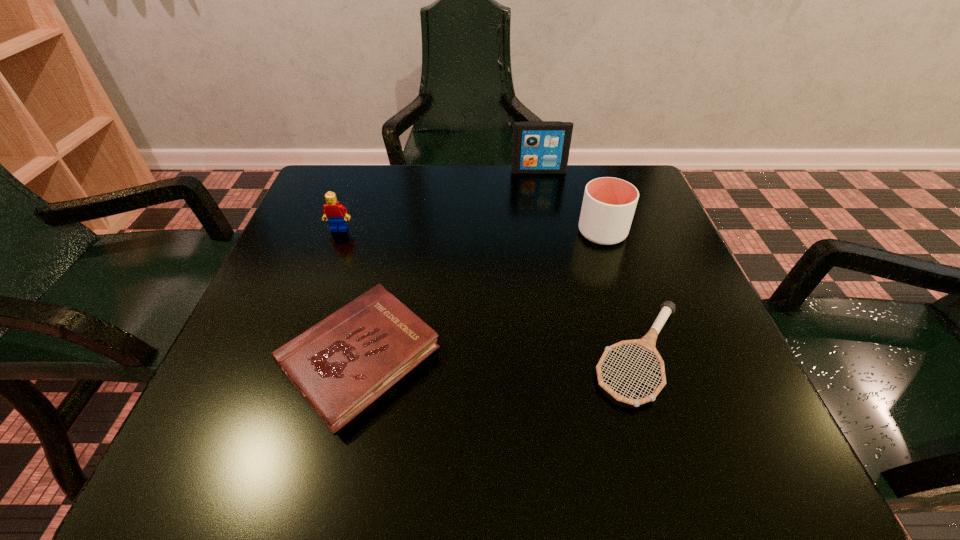
This screenshot has width=960, height=540. What are the coordinates of `iPod` in the screenshot? It's located at pos(539,147).

I want to click on the farthest object, so click(539, 147).

At what (x,y) coordinates should I click in order to perform the action: click on cup. Please return your answer as a coordinate pair (x, y). The image size is (960, 540). Looking at the image, I should click on (609, 204).

Identify the location of Lego. (334, 212).

The image size is (960, 540). Identify the location of the second shortest object. (342, 364).

Where is `the shortest object`? Image resolution: width=960 pixels, height=540 pixels. the shortest object is located at coordinates (647, 342).

This screenshot has height=540, width=960. In order to click on vacant space located on the front screen of the farthest object in this screenshot , I will do `click(541, 187)`.

Identify the location of blank space located on the left of the cup. (472, 232).

At what (x,y) coordinates should I click in order to perform the action: click on vacant region located on the front-facing side of the Lego. Please return your answer as a coordinate pair (x, y). The width and height of the screenshot is (960, 540). Looking at the image, I should click on (304, 324).

Find the location of a particular element. free region located 0.070m on the back of the hardback book is located at coordinates (380, 274).